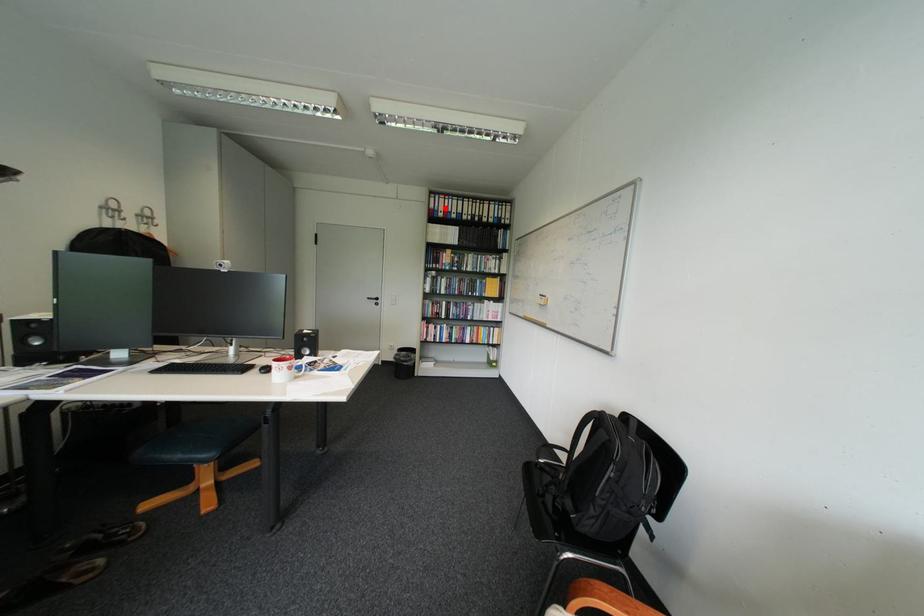
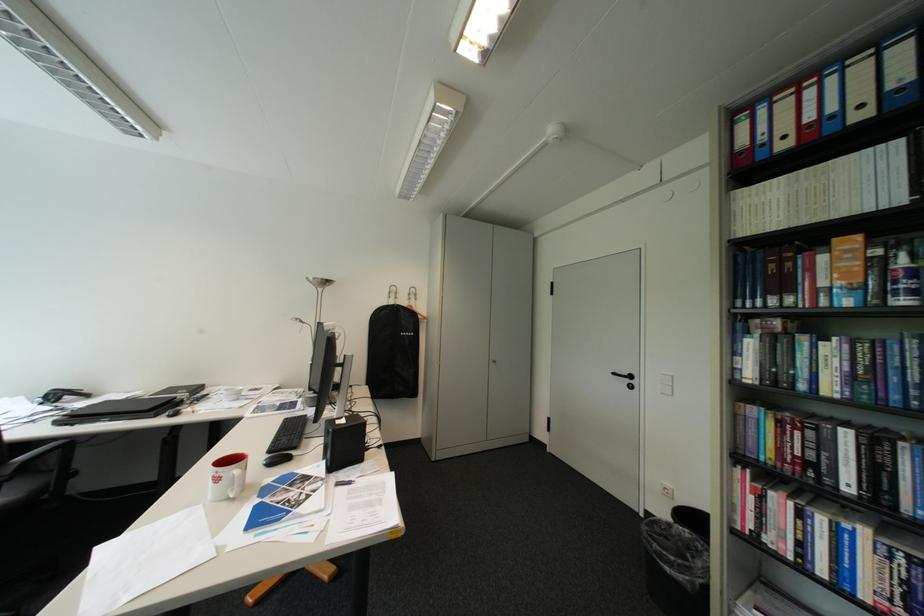
Where in the second image is the point corresponding to the highlighted location from the first image?

(760, 145)